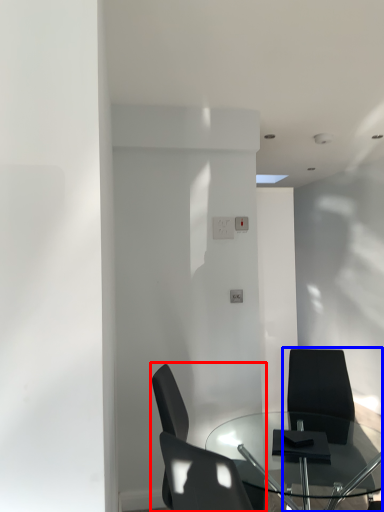
Question: Among these objects, which one is farthest to the camera, chair (highlighted by a red box) or chair (highlighted by a blue box)?

Choices:
 (A) chair
 (B) chair

Answer: (B)